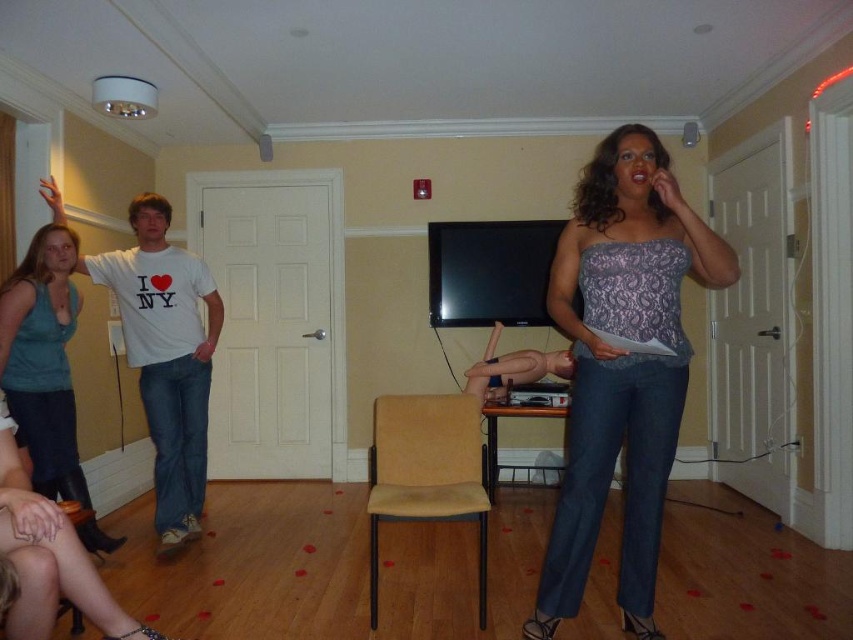
Question: Which point appears closest to the camera in this image?

Choices:
 (A) (595, 268)
 (B) (42, 326)
 (C) (192, 420)

Answer: (A)

Question: Which object is closer to the camera taking this photo?

Choices:
 (A) teal matte tank top at left
 (B) lace fabric top at center
 (C) white cotton t-shirt at left

Answer: (B)

Question: Is white cotton t-shirt at left to the left of teal matte tank top at left from the viewer's perspective?

Choices:
 (A) yes
 (B) no

Answer: (B)

Question: Which of the following is the farthest from the observer?

Choices:
 (A) white cotton t-shirt at left
 (B) teal matte tank top at left
 (C) lace fabric top at center

Answer: (A)

Question: Is lace fabric top at center above teal matte tank top at left?

Choices:
 (A) no
 (B) yes

Answer: (B)

Question: Is lace fabric top at center below teal matte tank top at left?

Choices:
 (A) no
 (B) yes

Answer: (A)